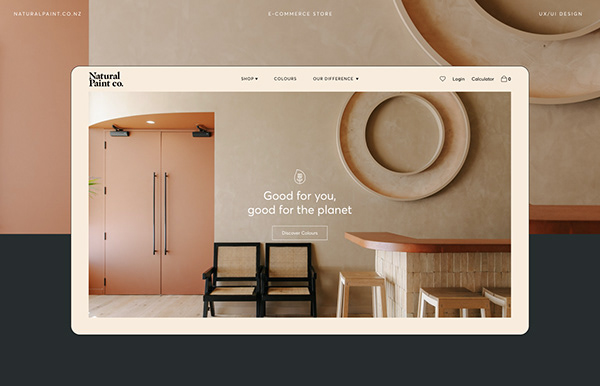
Locate an element on the screen. Image resolution: width=600 pixels, height=386 pixels. door handles is located at coordinates (153, 232), (165, 232).